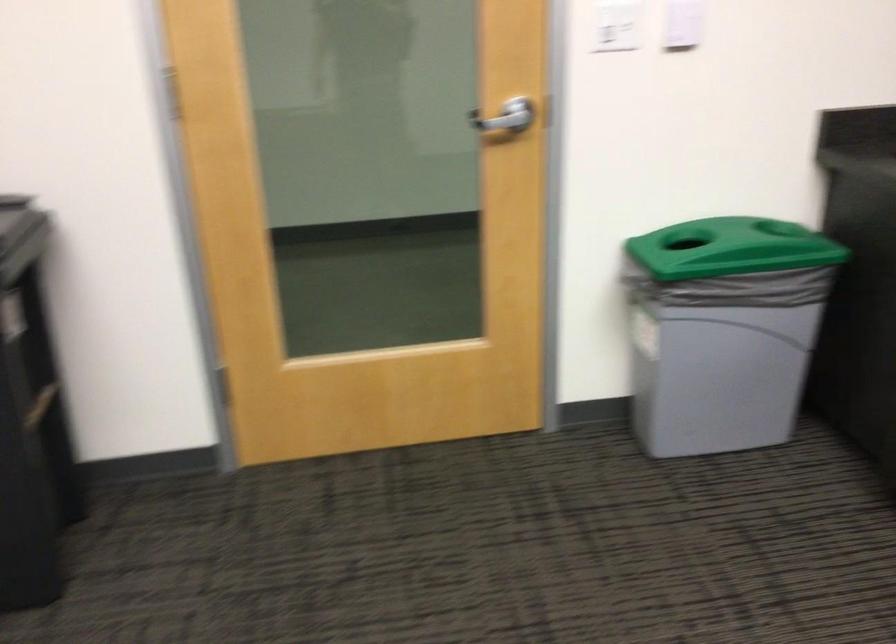
Where would you push the white light switch? Please return your answer as a coordinate pair (x, y).

(616, 24)